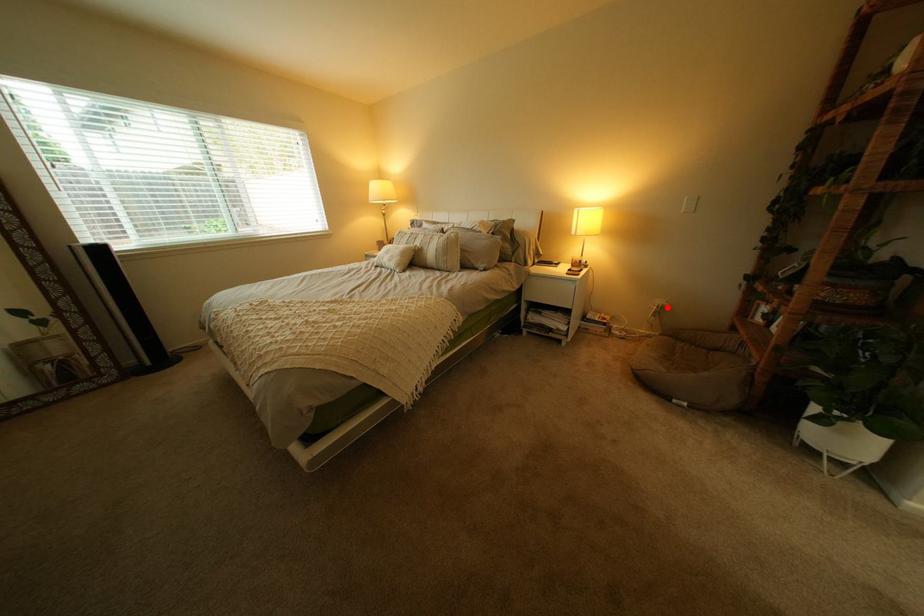
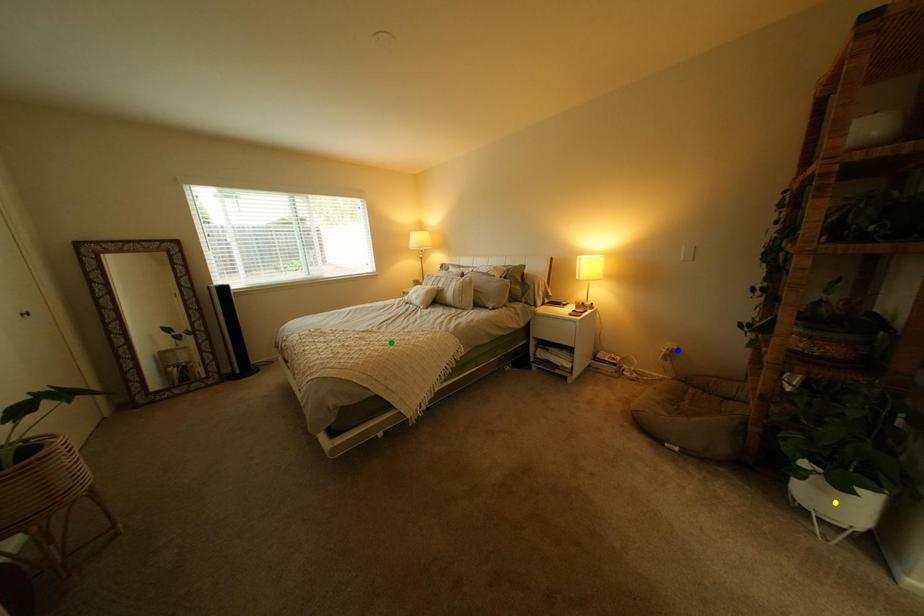
Question: I am providing you with two images of the same scene from different viewpoints. A red point is marked on the first image. You are given multiple points on the second image. Which mark in image 2 goes with the point in image 1?

Choices:
 (A) yellow point
 (B) green point
 (C) blue point

Answer: (C)